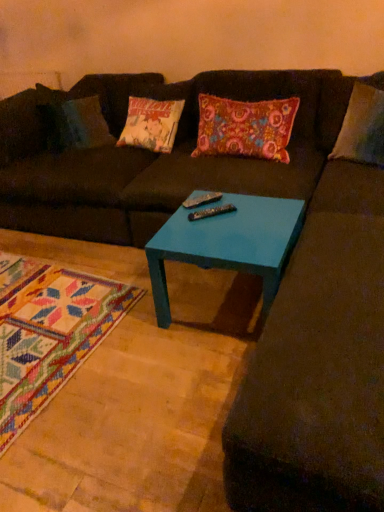
Question: Based on their sizes in the image, would you say floral fabric pillow at center is bigger or smaller than matte brown futon at center?

Choices:
 (A) small
 (B) big

Answer: (A)

Question: Considering the positions of floral fabric pillow at center and matte brown futon at center in the image, is floral fabric pillow at center wider or thinner than matte brown futon at center?

Choices:
 (A) thin
 (B) wide

Answer: (A)

Question: Based on their relative distances, which object is farther from the black plastic remote at center, the first remote in the front-to-back sequence?

Choices:
 (A) teal glossy table at center
 (B) metallic silver remote at center, which appears as the 2th remote when viewed from the front
 (C) matte brown futon at center
 (D) floral fabric pillow at center

Answer: (C)

Question: Which object is positioned closest to the matte brown futon at center?

Choices:
 (A) floral fabric pillow at center
 (B) metallic silver remote at center, which appears as the 2th remote when viewed from the front
 (C) black plastic remote at center, the first remote in the front-to-back sequence
 (D) teal glossy table at center

Answer: (A)